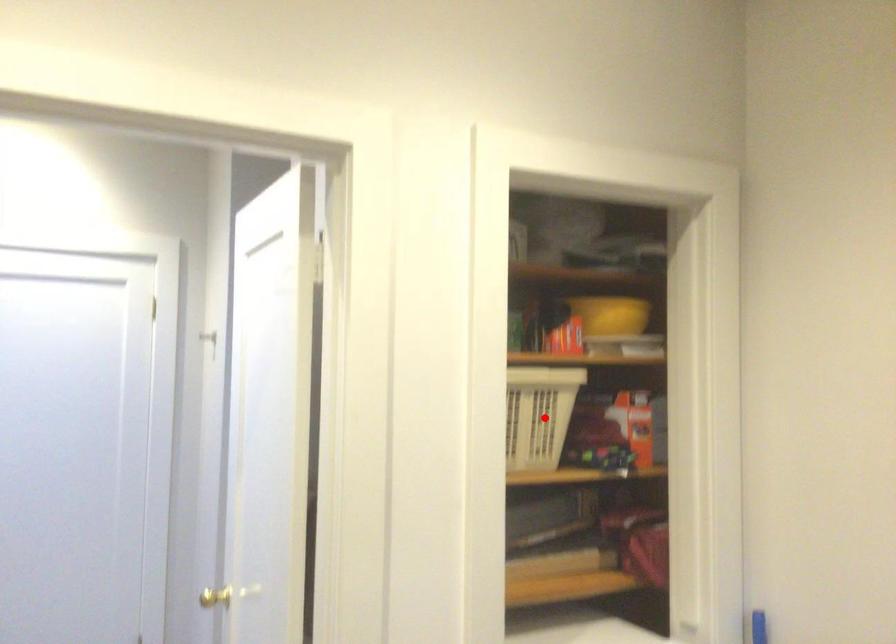
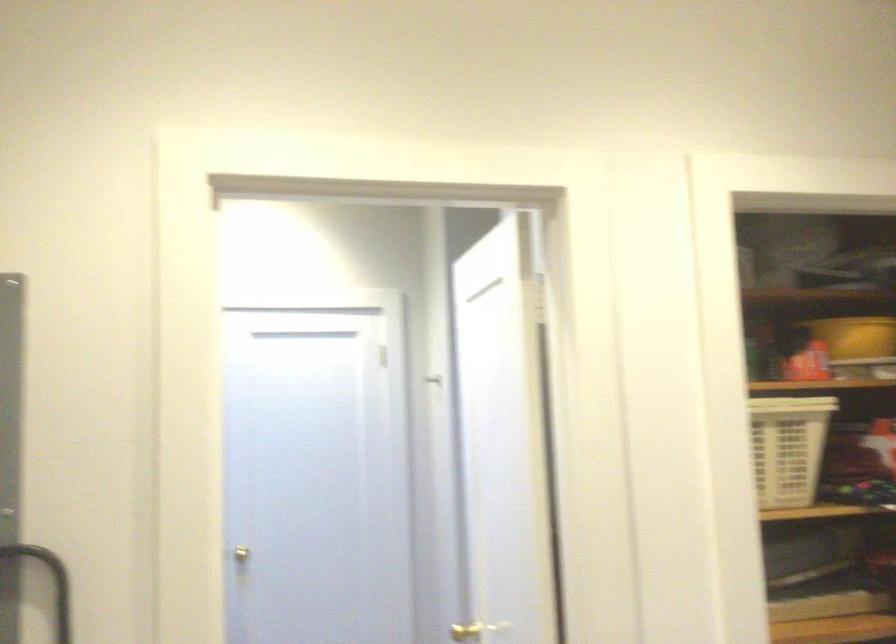
Find the pixel in the second image that matches the highlighted location in the first image.

(788, 448)